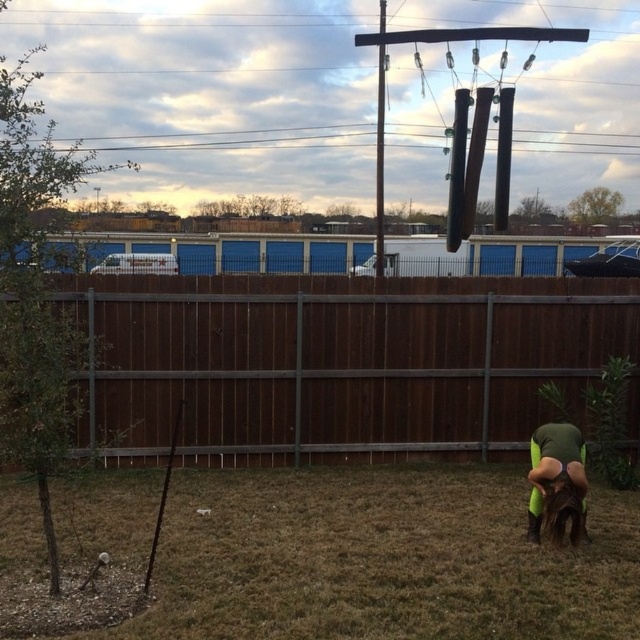
You are standing at the camera position and want to pick up the brown dry grass at lower center. Can you reach it without moving your feet?

The brown dry grass at lower center is 5.03 meters away from the camera, so you cannot reach it without moving your feet since the average human arm length is about 0.7 meters.

You are standing in the outdoor scene and see the green fabric at lower right and the brown furry dog at lower right. Which object is positioned further to the right?

The green fabric at lower right is positioned further to the right than the brown furry dog at lower right.

You are standing in the scene and want to walk from the brown dry grass at lower center to the brown furry dog at lower right. Which direction should you move to get closer to the dog?

Since the brown dry grass at lower center is closer to the viewer than the brown furry dog at lower right, you should move forward away from the viewer to reach the dog.